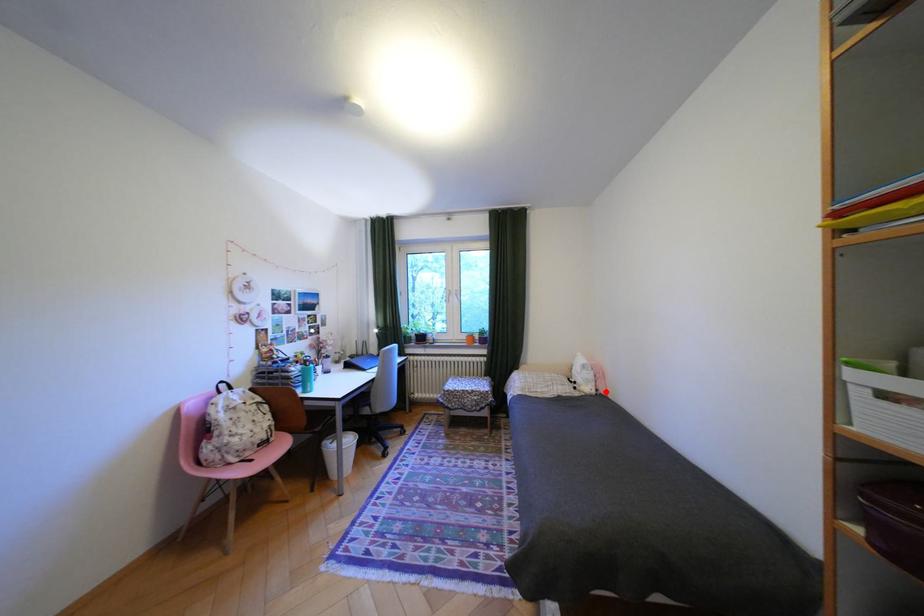
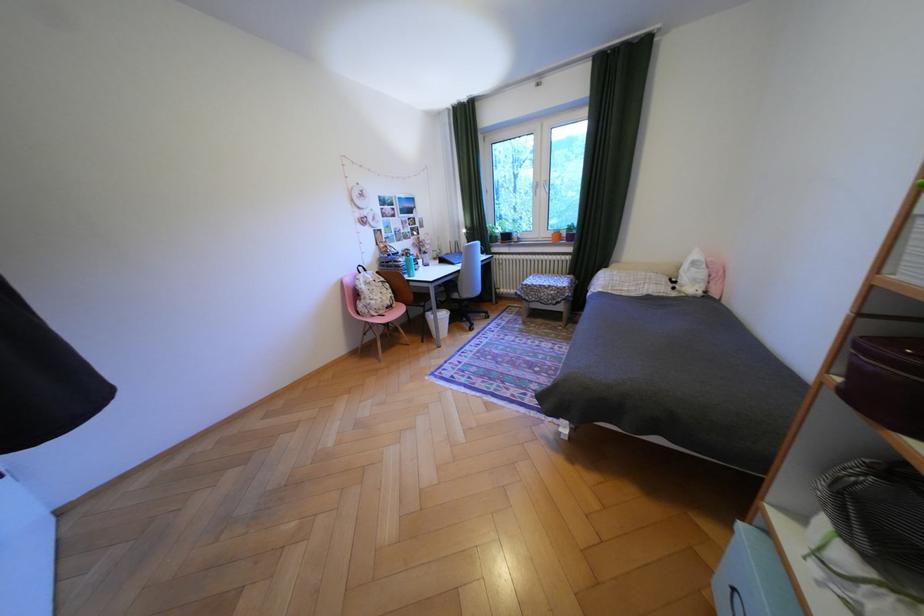
Find the pixel in the second image that matches the highlighted location in the first image.

(712, 293)